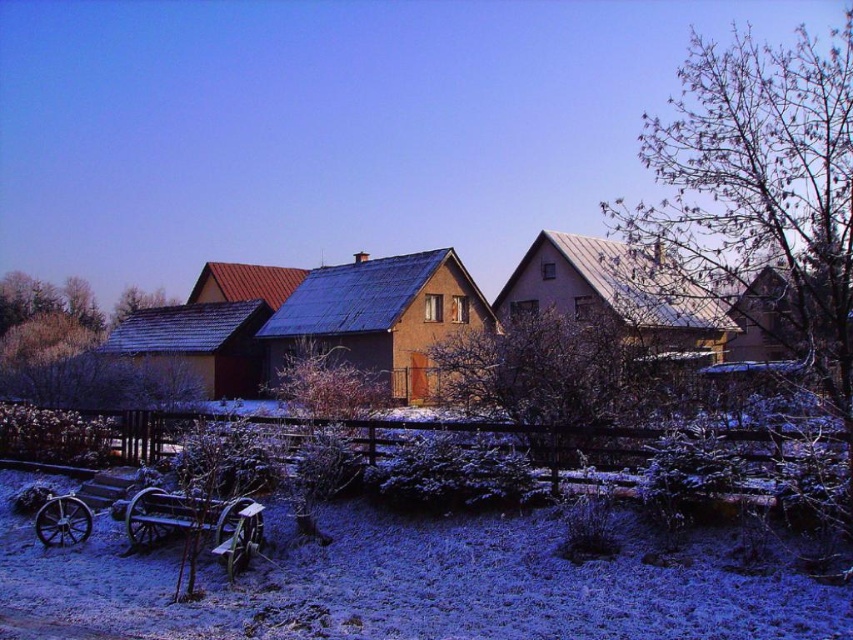
You are a GUI agent. You are given a task and a screenshot of the screen. Output one action in this format:
    pyautogui.click(x=<x>, y=<y>)
    Task: Click on the metallic gray house at center
    
    Given the screenshot: What is the action you would take?
    pyautogui.click(x=618, y=296)

Who is more distant from viewer, (643, 340) or (351, 374)?

Point (351, 374)

Who is more distant from viewer, (585, 241) or (300, 486)?

Point (585, 241)

The height and width of the screenshot is (640, 853). In order to click on metallic gray house at center in this screenshot , I will do `click(618, 296)`.

Can you confirm if bare branches at center is positioned to the left of brown corrugated roof at center?

In fact, bare branches at center is to the right of brown corrugated roof at center.

Who is positioned more to the right, bare branches at center or brown corrugated roof at center?

bare branches at center

Measure the distance between point (x=550, y=333) and camera.

Point (x=550, y=333) and camera are 12.31 meters apart.

Locate an element on the screen. This screenshot has height=640, width=853. bare branches at center is located at coordinates (546, 378).

Does brown textured tree at center lie in front of wooden wagon at lower left?

No, brown textured tree at center is further to the viewer.

Can you confirm if brown textured tree at center is shorter than wooden wagon at lower left?

Incorrect, brown textured tree at center's height does not fall short of wooden wagon at lower left's.

The width and height of the screenshot is (853, 640). Identify the location of brown textured tree at center. (328, 384).